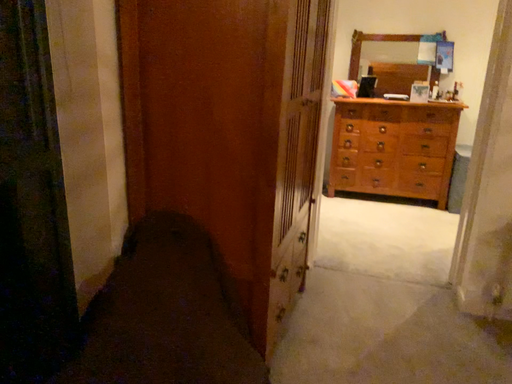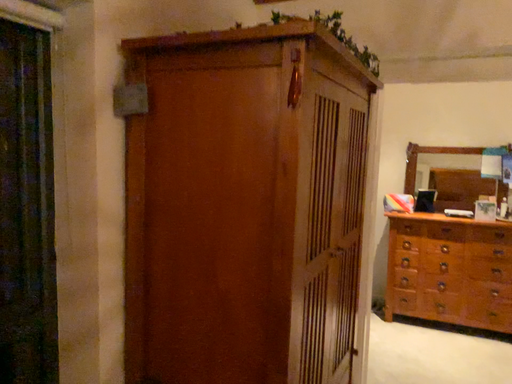
Question: Which way did the camera rotate in the video?

Choices:
 (A) rotated downward
 (B) rotated upward

Answer: (B)